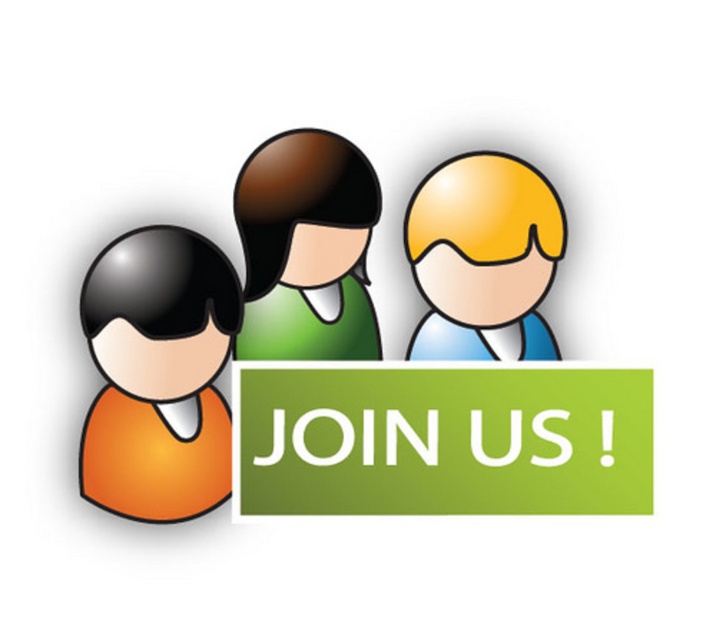
You are designing a poster and need to ensure that the green matte sign at center and the orange matte head at left are spaced appropriately. According to the design guidelines, elements must be at least 20 centimeters apart for readability. Based on the current layout, is the spacing between them sufficient?

The green matte sign at center and orange matte head at left are 19.24 centimeters apart from each other. Since the required minimum spacing is 20 centimeters, the current spacing is insufficient for readability.

You are designing a poster and want to ensure that the two green shirts in the figures are visually balanced. Which shirt should be placed on the left side to maintain symmetry if the matte green shirt at center is wider than the green matte shirt at center?

The matte green shirt at center should be placed on the left side because it is wider than the green matte shirt at center, helping to create a balanced visual symmetry.

Based on the photo, you are designing a poster and need to ensure that the green matte sign at center is clearly visible above the orange matte head at left. Given that the sign must be larger than the head, does the current design meet this requirement?

The green matte sign at center is bigger than orange matte head at left, so yes, the current design meets the requirement that the sign must be larger than the head.